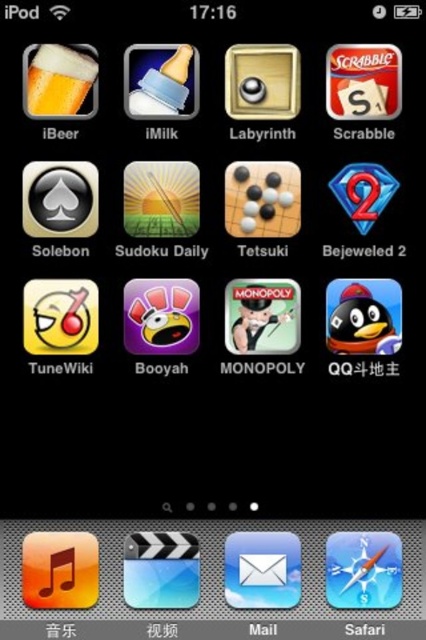
Based on the photo, you are designing a new app layout for an iPod. You have two icons to place next to each other horizontally. The white glossy envelope at center and the matte glass beer at upper left. Which icon should you choose to be on the left to ensure they fit without overlapping?

The matte glass beer at upper left should be placed on the left since it is narrower than the white glossy envelope at center, allowing both icons to fit side by side without overlapping.

You are holding an iPod and want to touch the point at coordinates point (256, 589). If your finger can reach up to 1.5 meters, will you be able to touch it?

The distance of point (256, 589) from camera is 1.51 meters, so your finger can reach up to 1.5 meters, which is shorter than the required distance. Therefore, you cannot touch it.